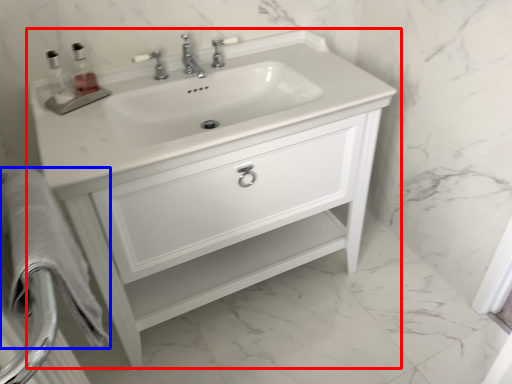
Question: Among these objects, which one is farthest to the camera, bathroom cabinet (highlighted by a red box) or bath towel (highlighted by a blue box)?

Choices:
 (A) bathroom cabinet
 (B) bath towel

Answer: (A)